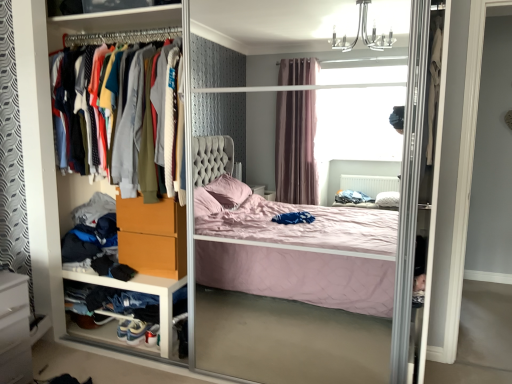
Question: Are white plastic drawer at lower left and white glossy vanity at lower left beside each other?

Choices:
 (A) yes
 (B) no

Answer: (B)

Question: Is white plastic drawer at lower left smaller than white glossy vanity at lower left?

Choices:
 (A) no
 (B) yes

Answer: (A)

Question: Can you confirm if white plastic drawer at lower left is wider than white glossy vanity at lower left?

Choices:
 (A) yes
 (B) no

Answer: (B)

Question: Would you say white plastic drawer at lower left is a long distance from white glossy vanity at lower left?

Choices:
 (A) no
 (B) yes

Answer: (A)

Question: Can you confirm if white plastic drawer at lower left is shorter than white glossy vanity at lower left?

Choices:
 (A) no
 (B) yes

Answer: (B)

Question: From the image's perspective, is matte plastic screen door at center above or below white plastic drawer at lower left?

Choices:
 (A) below
 (B) above

Answer: (B)

Question: Considering the positions of matte plastic screen door at center and white plastic drawer at lower left in the image, is matte plastic screen door at center wider or thinner than white plastic drawer at lower left?

Choices:
 (A) wide
 (B) thin

Answer: (A)

Question: From a real-world perspective, relative to white plastic drawer at lower left, is matte plastic screen door at center vertically above or below?

Choices:
 (A) above
 (B) below

Answer: (A)

Question: Does point (197, 269) appear closer or farther from the camera than point (160, 314)?

Choices:
 (A) farther
 (B) closer

Answer: (A)

Question: Visually, is matte plastic screen door at center positioned to the left or to the right of white glossy vanity at lower left?

Choices:
 (A) left
 (B) right

Answer: (B)

Question: Looking at their shapes, would you say matte plastic screen door at center is wider or thinner than white glossy vanity at lower left?

Choices:
 (A) thin
 (B) wide

Answer: (B)

Question: From the image's perspective, is matte plastic screen door at center located above or below white glossy vanity at lower left?

Choices:
 (A) above
 (B) below

Answer: (A)

Question: Is point (385, 375) positioned closer to the camera than point (9, 302)?

Choices:
 (A) closer
 (B) farther

Answer: (B)

Question: Is white plastic drawer at lower left to the left or to the right of matte plastic screen door at center in the image?

Choices:
 (A) right
 (B) left

Answer: (B)

Question: From the image's perspective, is white plastic drawer at lower left above or below matte plastic screen door at center?

Choices:
 (A) below
 (B) above

Answer: (A)